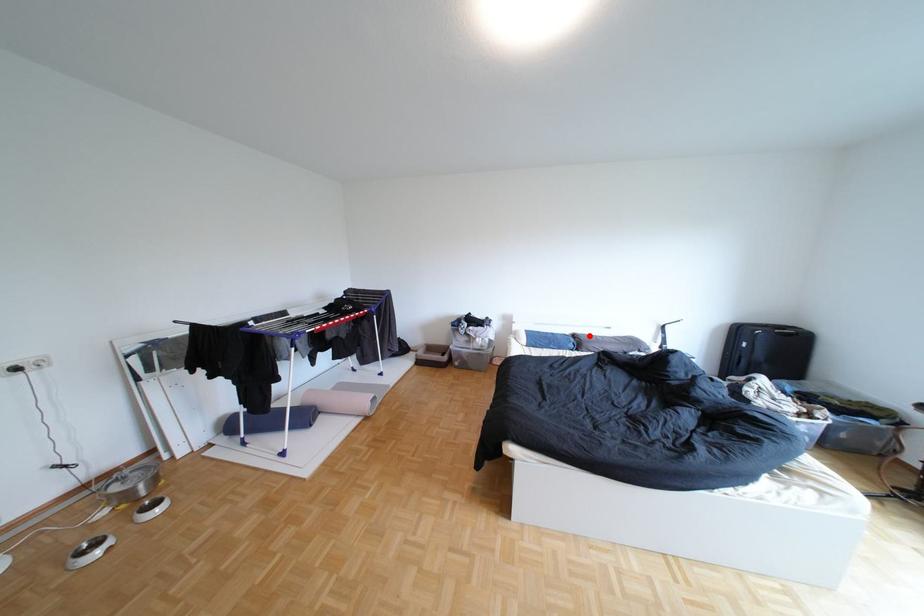
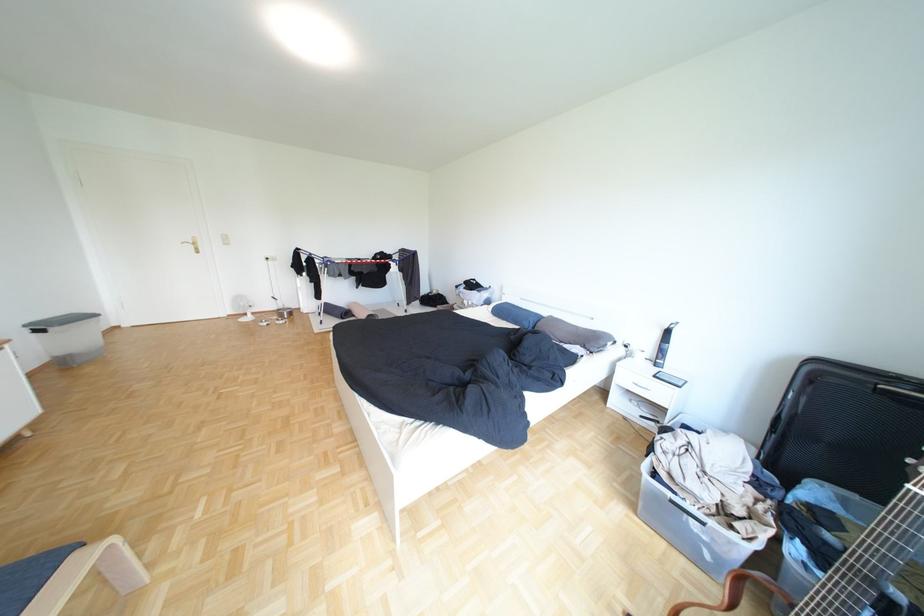
The point at the highlighted location is marked in the first image. Where is the corresponding point in the second image?

(564, 318)